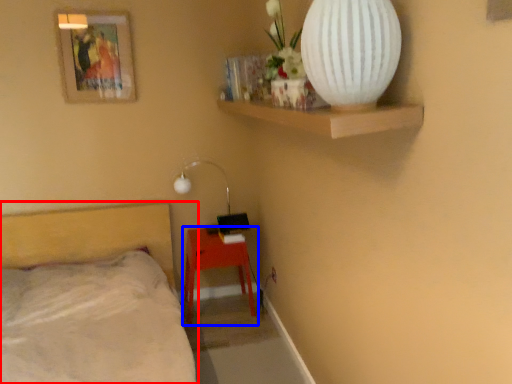
Question: Among these objects, which one is nearest to the camera, bed (highlighted by a red box) or nightstand (highlighted by a blue box)?

Choices:
 (A) bed
 (B) nightstand

Answer: (A)